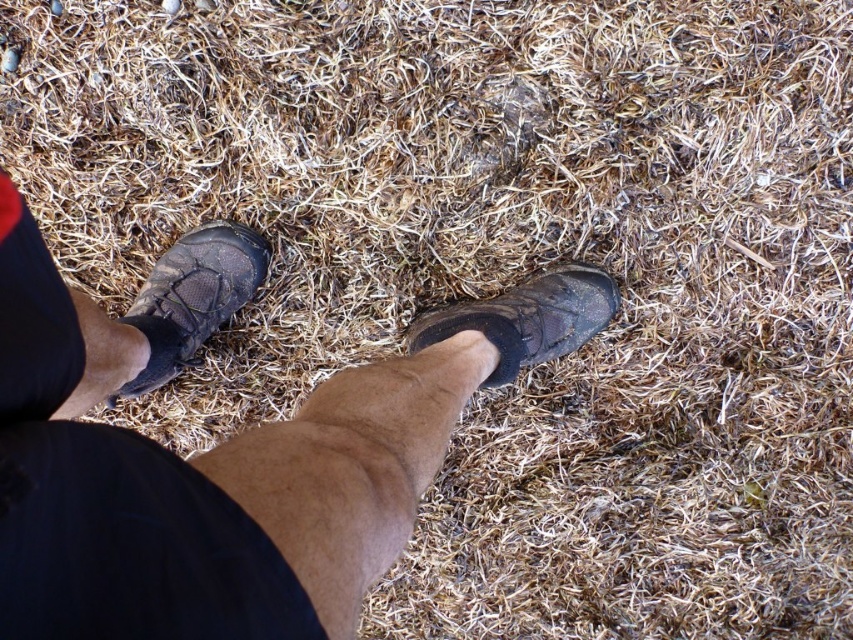
Consider the image. Which of these two, matte black shoe at left or leather boot at center, stands taller?

Standing taller between the two is matte black shoe at left.

Is point (173, 305) farther from viewer compared to point (538, 324)?

Yes, point (173, 305) is farther from viewer.

Find the location of `matte black shoe at left`. matte black shoe at left is located at coordinates (192, 296).